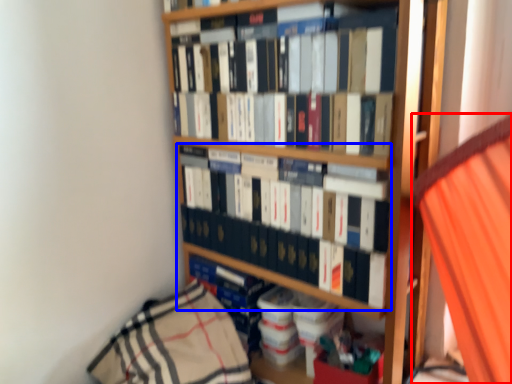
Question: Which of the following is the closest to the observer, curtain (highlighted by a red box) or book (highlighted by a blue box)?

Choices:
 (A) curtain
 (B) book

Answer: (A)